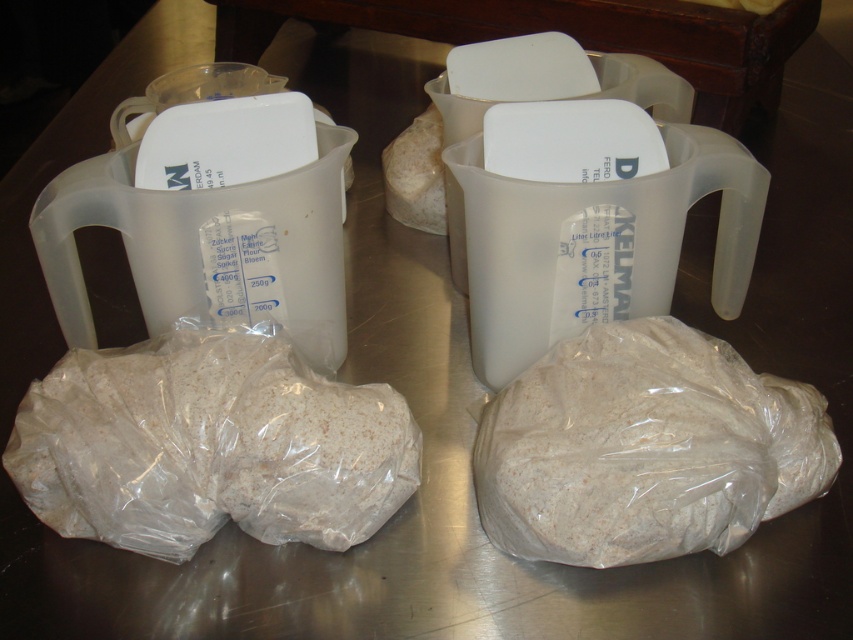
Based on the photo, does translucent plastic bag at lower left appear on the left side of transparent plastic jug at left?

Incorrect, translucent plastic bag at lower left is not on the left side of transparent plastic jug at left.

Is translucent plastic bag at lower left closer to camera compared to transparent plastic jug at left?

Yes, it is in front of transparent plastic jug at left.

Is point (136, 532) positioned behind point (302, 179)?

No.

Locate an element on the screen. translucent plastic bag at lower left is located at coordinates (209, 445).

Can you confirm if transparent plastic jug at center is shorter than transparent plastic jug at upper center?

No, transparent plastic jug at center is not shorter than transparent plastic jug at upper center.

Is point (576, 124) positioned after point (392, 186)?

No, (576, 124) is in front of (392, 186).

Is point (554, 108) behind point (650, 92)?

No, it is in front of (650, 92).

The height and width of the screenshot is (640, 853). I want to click on transparent plastic jug at center, so click(590, 221).

Which is more to the right, translucent plastic bag at lower right or transparent plastic jug at left?

translucent plastic bag at lower right is more to the right.

At what (x,y) coordinates should I click in order to perform the action: click on translucent plastic bag at lower right. Please return your answer as a coordinate pair (x, y). This screenshot has height=640, width=853. Looking at the image, I should click on (643, 449).

Which is behind, point (508, 422) or point (282, 276)?

The point (282, 276) is behind.

Where is `translucent plastic bag at lower right`? The width and height of the screenshot is (853, 640). translucent plastic bag at lower right is located at coordinates (643, 449).